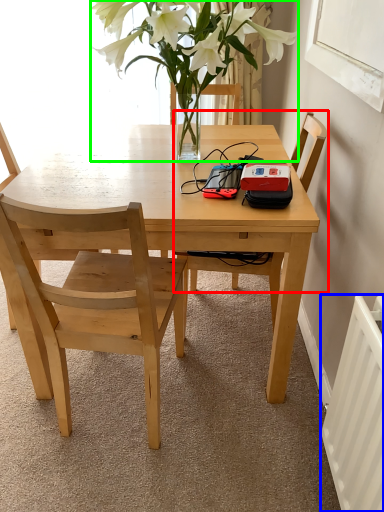
Question: Which is farther away from chair (highlighted by a red box)? radiator (highlighted by a blue box) or houseplant (highlighted by a green box)?

Choices:
 (A) radiator
 (B) houseplant

Answer: (A)